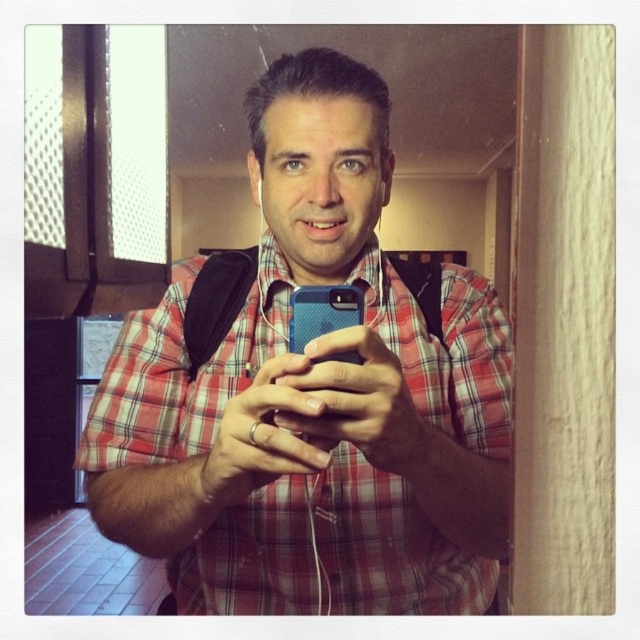
You are trying to decide which phone to buy between the blue matte phone at center and the blue textured phone at center. Based on the image, which one is bigger?

The blue matte phone at center is larger in size than the blue textured phone at center, so the blue matte phone at center is bigger.

You are a delivery robot trying to navigate through the hallway. There is a point at coordinates point [317,353] that you need to pass. Can you safely pass through this point if your robot has a height of 16 inches?

The distance of point [317,353] from camera is 17.16 inches. Since the robot is 16 inches tall, it can safely pass under the point as it is shorter than the clearance height of 17.16 inches.

You are a photographer trying to capture both the blue matte phone at center and the blue textured phone at center in the same frame. Since they are both at the center, which one is positioned to the left?

The blue matte phone at center is positioned to the left of the blue textured phone at center.